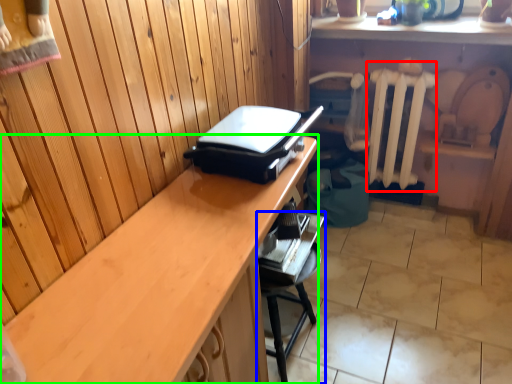
Question: Based on their relative distances, which object is farther from radiator (highlighted by a red box)? Choose from furniture (highlighted by a blue box) and desk (highlighted by a green box).

Choices:
 (A) furniture
 (B) desk

Answer: (B)